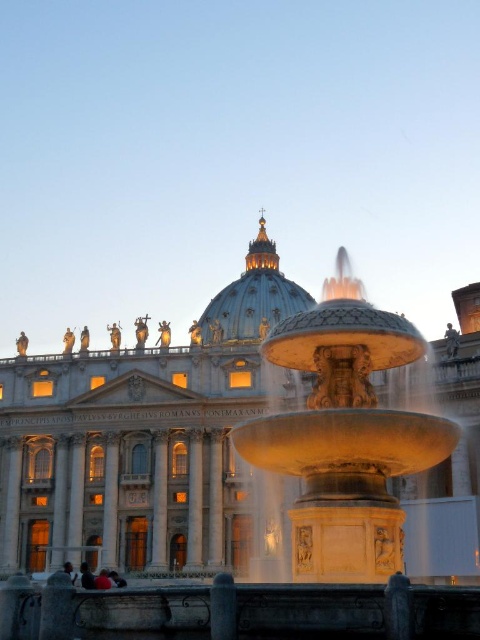
Who is shorter, smooth skin person at lower left or dark hair person at lower left?

dark hair person at lower left is shorter.

Between smooth skin person at lower left and dark hair person at lower left, which one is positioned lower?

dark hair person at lower left is below.

Which is behind, point (94, 580) or point (120, 582)?

Point (120, 582)

Locate an element on the screen. smooth skin person at lower left is located at coordinates (103, 580).

Who is lower down, white marble palace at center or golden stone dome at center?

white marble palace at center

This screenshot has height=640, width=480. What are the coordinates of `white marble palace at center` in the screenshot? It's located at (152, 444).

Image resolution: width=480 pixels, height=640 pixels. Describe the element at coordinates (152, 444) in the screenshot. I see `white marble palace at center` at that location.

You are a GUI agent. You are given a task and a screenshot of the screen. Output one action in this format:
    pyautogui.click(x=<x>, y=<y>)
    Task: Click on the white marble palace at center
    The height and width of the screenshot is (640, 480).
    Given the screenshot: What is the action you would take?
    pyautogui.click(x=152, y=444)

Between white marble palace at center and gold polished stone fountain at center, which one has less height?

gold polished stone fountain at center is shorter.

Who is positioned more to the left, white marble palace at center or gold polished stone fountain at center?

From the viewer's perspective, white marble palace at center appears more on the left side.

Is point (94, 504) closer to viewer compared to point (350, 385)?

No, it is behind (350, 385).

Where is `white marble palace at center`? white marble palace at center is located at coordinates (152, 444).